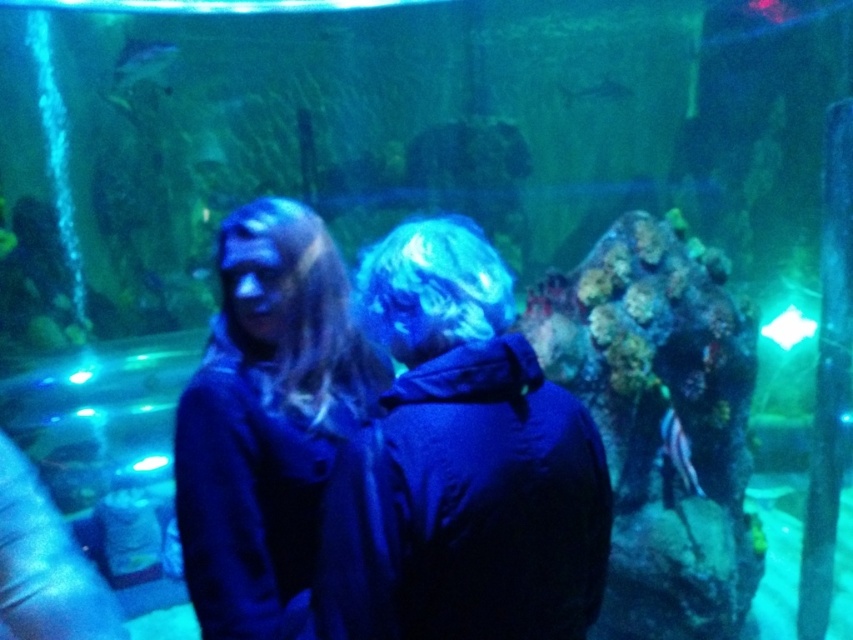
You are a visitor at the aquarium and want to take a photo of the shiny silver fish at upper left. The aquarium has a glass panel at the bottom of the tank. To get the best shot, you need to stand directly in front of the fish. Based on its position, where should you position yourself relative to the tank?

The shiny silver fish at upper left is located at point (144, 64), which corresponds to the upper left area of the tank. To take the best photo, you should position yourself directly in front of the upper left section of the tank where the fish is swimming.

You are designing a virtual tour of this aquarium exhibit and need to place a 3D arrow pointing to the dark blue fabric at center. What coordinates should the arrow point to?

The arrow should point to the coordinates at point (461, 465), as that is the 2D location of the dark blue fabric at center.

You are a visitor at the aquarium and notice a dark blue fabric at center. Can you confirm if the point marked at coordinates (461, 465) corresponds to the location of the dark blue fabric at center?

Yes, the dark blue fabric at center is represented by point (461, 465), so the point marked at coordinates (461, 465) corresponds to the location of the dark blue fabric at center.